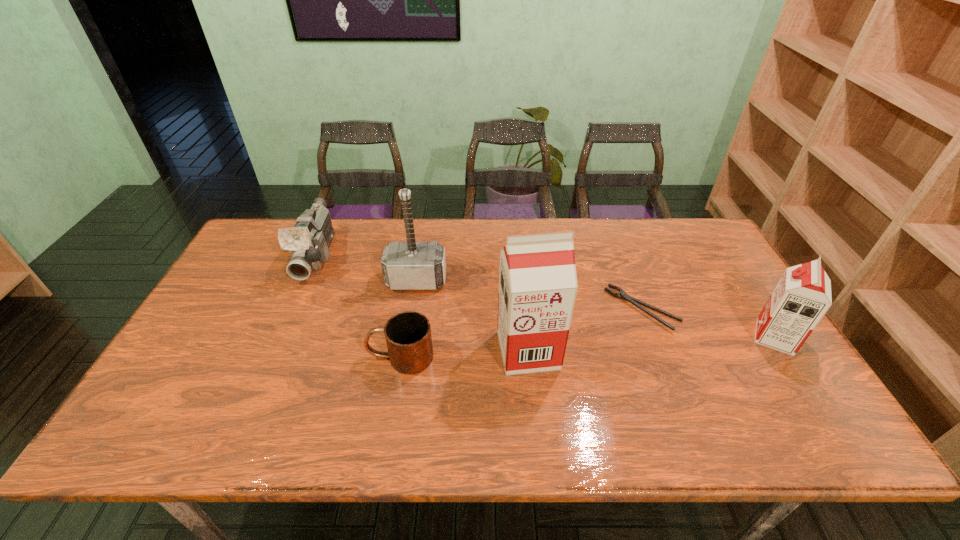
You are a GUI agent. You are given a task and a screenshot of the screen. Output one action in this format:
    pyautogui.click(x=<x>, y=<y>)
    Task: Click on the blank space located 0.290m on the right of the left soya milk
    
    Given the screenshot: What is the action you would take?
    pyautogui.click(x=670, y=350)

At what (x,y) coordinates should I click in order to perform the action: click on vacant space located on the back of the shorter soya milk. Please return your answer as a coordinate pair (x, y). Looking at the image, I should click on (709, 235).

Find the location of a particular element. The width and height of the screenshot is (960, 540). vacant space located on the front-facing side of the camcorder is located at coordinates 258,395.

At what (x,y) coordinates should I click in order to perform the action: click on vacant region located 0.370m for striking with the head of the second tallest object. Please return your answer as a coordinate pair (x, y). Image resolution: width=960 pixels, height=540 pixels. Looking at the image, I should click on (397, 403).

In order to click on free region located on the back of the fifth object from left to right in this screenshot , I will do `click(625, 261)`.

Find the location of a particular element. The image size is (960, 540). free space located 0.090m on the side of the mug with the handle is located at coordinates (332, 357).

Find the location of a particular element. This screenshot has width=960, height=540. free space located 0.240m on the side of the mug with the handle is located at coordinates pos(274,357).

Identify the location of vacant region located 0.300m on the side of the mug with the handle. (251, 357).

Where is `object situated at the far edge`? The height and width of the screenshot is (540, 960). object situated at the far edge is located at coordinates (308, 241).

You are a GUI agent. You are given a task and a screenshot of the screen. Output one action in this format:
    pyautogui.click(x=<x>, y=<y>)
    Task: Click on the object at the right edge
    
    Given the screenshot: What is the action you would take?
    pyautogui.click(x=801, y=298)